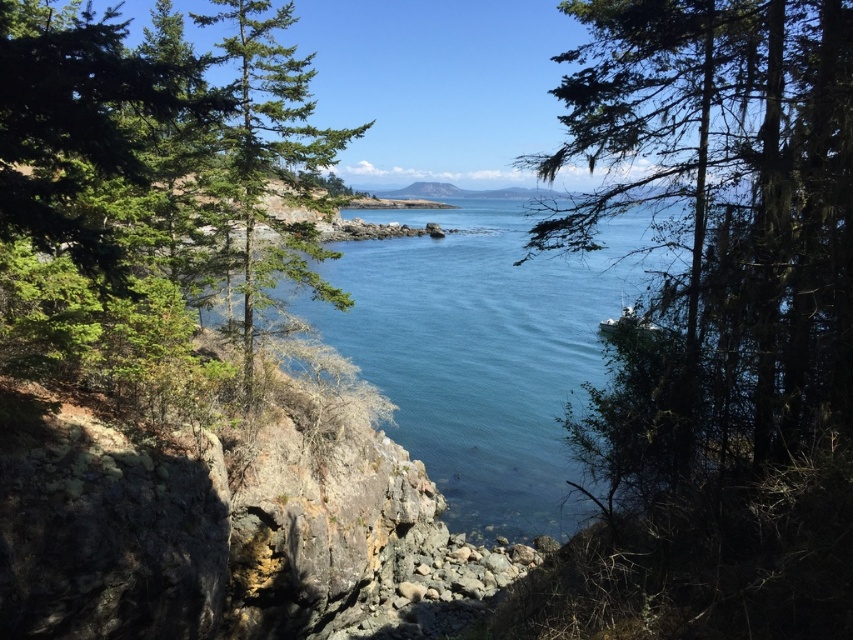
Question: Among these objects, which one is nearest to the camera?

Choices:
 (A) green needle-like tree at center
 (B) clear blue water at center

Answer: (B)

Question: Is clear blue water at center to the left of green needle-like tree at center from the viewer's perspective?

Choices:
 (A) no
 (B) yes

Answer: (A)

Question: Does clear blue water at center appear on the right side of green needle-like tree at center?

Choices:
 (A) yes
 (B) no

Answer: (A)

Question: Observing the image, what is the correct spatial positioning of clear blue water at center in reference to green needle-like tree at center?

Choices:
 (A) right
 (B) left

Answer: (A)